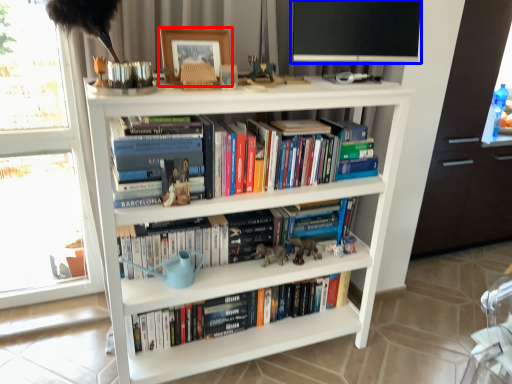
Question: Which of the following is the closest to the observer, picture frame (highlighted by a red box) or computer monitor (highlighted by a blue box)?

Choices:
 (A) picture frame
 (B) computer monitor

Answer: (A)